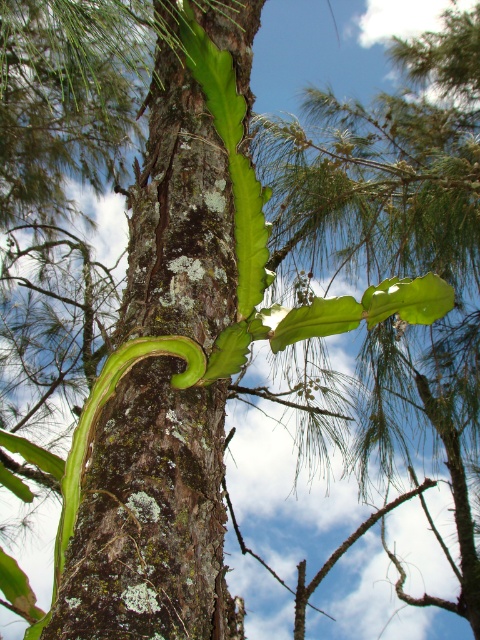
You are a botanist examining the tree trunk and the plant growing on it. Which of the two, the green rough bark tree trunk at center or the green leafy plant at center, is taller?

The green rough bark tree trunk at center is taller than the green leafy plant at center.

You are a botanist examining a tree trunk with a unique plant growing on it. You notice a point marked at coordinates (149, 516). What is located at this point on the tree trunk?

The point at coordinates (149, 516) is occupied by the green rough bark tree trunk at center.